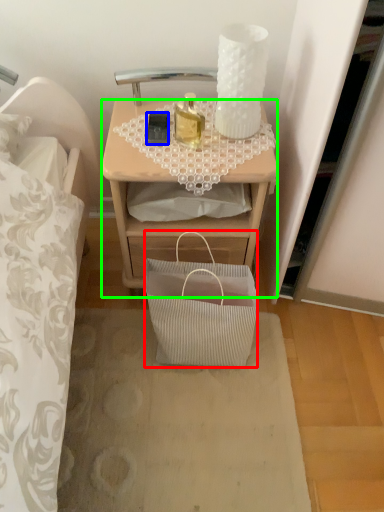
Question: Based on their relative distances, which object is nearer to handbag (highlighted by a red box)? Choose from mobile phone (highlighted by a blue box) and desk (highlighted by a green box).

Choices:
 (A) mobile phone
 (B) desk

Answer: (B)